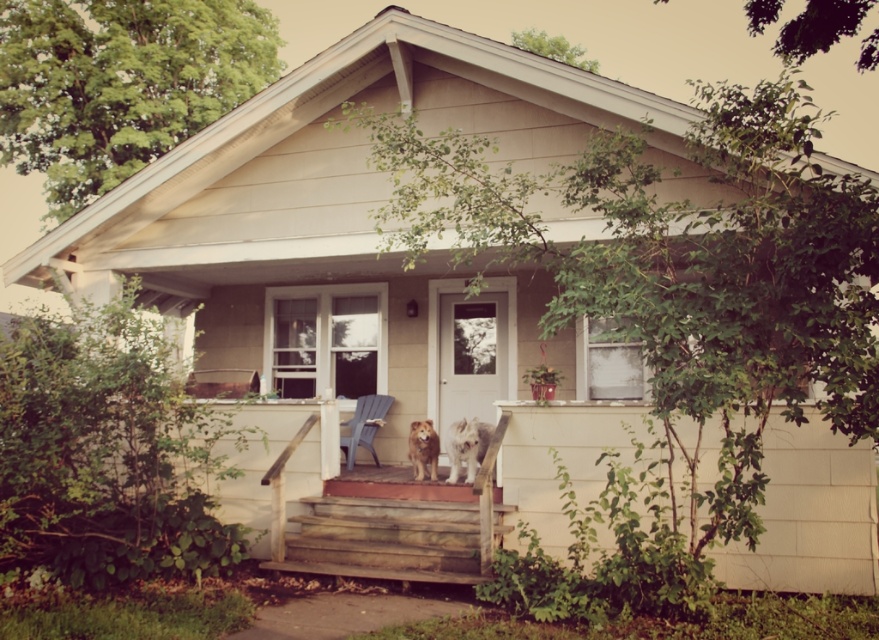
You are standing on the front yard and want to approach the entrance of the house. There are weathered wood stairs at center and a brown furry dog at center on the porch. Which object is closer to you as you approach the entrance?

The weathered wood stairs at center is in front of the brown furry dog at center, so the stairs are closer to you as you approach the entrance.

You are standing on the front porch of the house and want to place a small potted plant between the two points marked as point (476,502) and point (415,472). Which point should the plant be closer to in order to be positioned in front of the other point?

The plant should be closer to point (476,502) because it is in front of point (415,472).